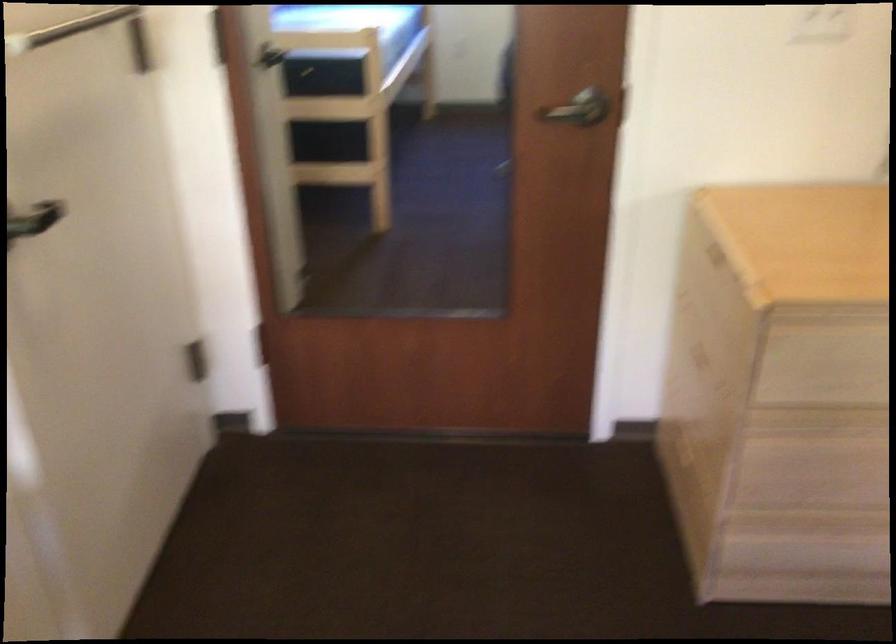
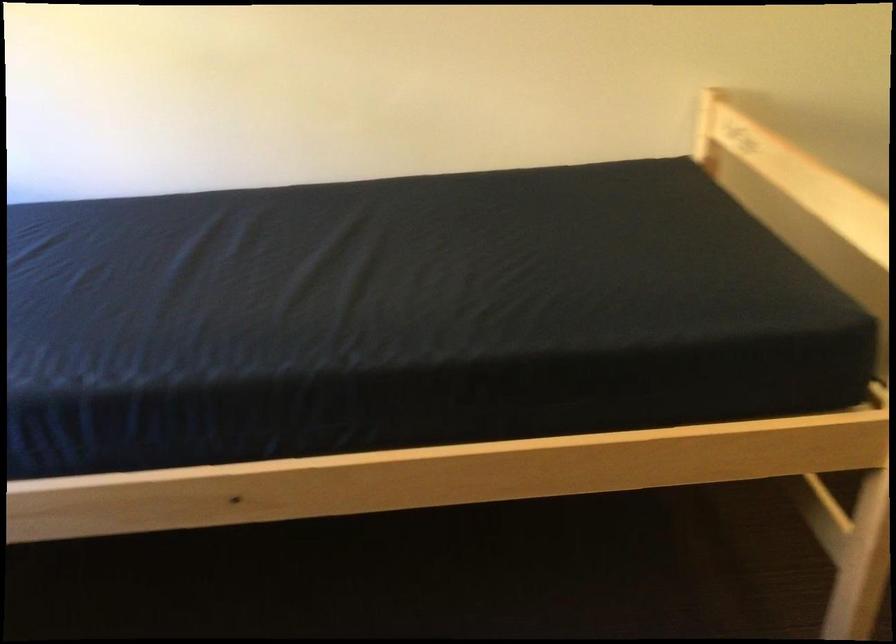
First-person continuous shooting, in which direction is the camera rotating?

The camera's rotation is toward left-down.